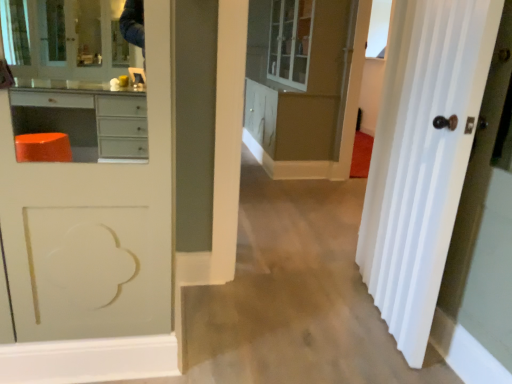
Question: Considering the relative sizes of transparent glass window at upper right and white glossy door at right in the image provided, is transparent glass window at upper right smaller than white glossy door at right?

Choices:
 (A) yes
 (B) no

Answer: (A)

Question: From the image's perspective, would you say transparent glass window at upper right is positioned over white glossy door at right?

Choices:
 (A) no
 (B) yes

Answer: (B)

Question: Is transparent glass window at upper right to the left of white glossy door at right from the viewer's perspective?

Choices:
 (A) no
 (B) yes

Answer: (A)

Question: Is the depth of transparent glass window at upper right greater than that of white glossy door at right?

Choices:
 (A) yes
 (B) no

Answer: (A)

Question: Does transparent glass window at upper right appear on the right side of white glossy door at right?

Choices:
 (A) yes
 (B) no

Answer: (A)

Question: From the image's perspective, would you say transparent glass window at upper right is shown under white glossy door at right?

Choices:
 (A) yes
 (B) no

Answer: (B)

Question: Does white glossy door at right have a lesser width compared to transparent glass window at upper right?

Choices:
 (A) no
 (B) yes

Answer: (A)

Question: Does white glossy door at right have a greater width compared to transparent glass window at upper right?

Choices:
 (A) no
 (B) yes

Answer: (B)

Question: Is white glossy door at right bigger than transparent glass window at upper right?

Choices:
 (A) yes
 (B) no

Answer: (A)

Question: Are white glossy door at right and transparent glass window at upper right located far from each other?

Choices:
 (A) no
 (B) yes

Answer: (B)

Question: Does white glossy door at right have a smaller size compared to transparent glass window at upper right?

Choices:
 (A) yes
 (B) no

Answer: (B)

Question: Is white glossy door at right shorter than transparent glass window at upper right?

Choices:
 (A) no
 (B) yes

Answer: (A)

Question: Could you tell me if transparent glass window at upper right is facing matte white cabinet at center?

Choices:
 (A) yes
 (B) no

Answer: (A)